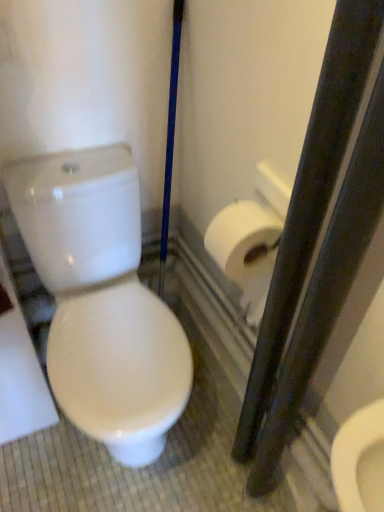
From the picture: What is the approximate height of white matte toilet paper at right?

The height of white matte toilet paper at right is 15.34 inches.

The image size is (384, 512). What do you see at coordinates (246, 251) in the screenshot? I see `white matte toilet paper at right` at bounding box center [246, 251].

The image size is (384, 512). Find the location of `white matte toilet paper at right`. white matte toilet paper at right is located at coordinates (246, 251).

Describe the element at coordinates (101, 300) in the screenshot. I see `white glossy toilet at left` at that location.

I want to click on white glossy toilet at left, so click(x=101, y=300).

What is the approximate height of white glossy toilet at left?

white glossy toilet at left is 30.87 inches tall.

Locate an element on the screen. white matte toilet paper at right is located at coordinates (246, 251).

Considering the positions of objects white glossy toilet at left and white matte toilet paper at right in the image provided, who is more to the left, white glossy toilet at left or white matte toilet paper at right?

white glossy toilet at left is more to the left.

Which is behind, white glossy toilet at left or white matte toilet paper at right?

Positioned behind is white matte toilet paper at right.

Is point (96, 237) behind point (251, 242)?

Yes, it is behind point (251, 242).

From the image's perspective, which is below, white glossy toilet at left or white matte toilet paper at right?

From the image's view, white glossy toilet at left is below.

From a real-world perspective, is white glossy toilet at left positioned above or below white matte toilet paper at right?

white glossy toilet at left is situated lower than white matte toilet paper at right in the real world.

Can you confirm if white glossy toilet at left is wider than white matte toilet paper at right?

Indeed, white glossy toilet at left has a greater width compared to white matte toilet paper at right.

Who is taller, white glossy toilet at left or white matte toilet paper at right?

white glossy toilet at left is taller.

Which of these two, white glossy toilet at left or white matte toilet paper at right, is smaller?

With smaller size is white matte toilet paper at right.

Is white matte toilet paper at right completely or partially inside white glossy toilet at left?

No, white matte toilet paper at right is located outside of white glossy toilet at left.

Can you see white glossy toilet at left touching white matte toilet paper at right?

There is a gap between white glossy toilet at left and white matte toilet paper at right.

Is white matte toilet paper at right at the back of white glossy toilet at left?

No.

Can you tell me how much white glossy toilet at left and white matte toilet paper at right differ in facing direction?

89.5 degrees.

Locate an element on the screen. toilet paper that is behind the white glossy toilet at left is located at coordinates point(246,251).

Is white matte toilet paper at right at the left side of white glossy toilet at left?

In fact, white matte toilet paper at right is to the right of white glossy toilet at left.

Which object is more forward, white matte toilet paper at right or white glossy toilet at left?

white glossy toilet at left is in front.

Which is closer, (273, 214) or (39, 189)?

The point (273, 214) is in front.

From the image's perspective, between white matte toilet paper at right and white glossy toilet at left, who is located below?

white glossy toilet at left is shown below in the image.

From a real-world perspective, is white matte toilet paper at right positioned under white glossy toilet at left based on gravity?

No, from a real-world perspective, white matte toilet paper at right is not beneath white glossy toilet at left.

Considering the relative sizes of white matte toilet paper at right and white glossy toilet at left in the image provided, is white matte toilet paper at right thinner than white glossy toilet at left?

Yes.

Looking at this image, does white matte toilet paper at right have a lesser height compared to white glossy toilet at left?

Correct, white matte toilet paper at right is not as tall as white glossy toilet at left.

Considering the sizes of objects white matte toilet paper at right and white glossy toilet at left in the image provided, who is smaller, white matte toilet paper at right or white glossy toilet at left?

white matte toilet paper at right is smaller.

Is white glossy toilet at left located within white matte toilet paper at right?

No.

Is white matte toilet paper at right in contact with white glossy toilet at left?

white matte toilet paper at right is not next to white glossy toilet at left, and they're not touching.

Could you tell me if white matte toilet paper at right is facing white glossy toilet at left?

Yes, white matte toilet paper at right is oriented towards white glossy toilet at left.

In the scene shown: Can you tell me how much white matte toilet paper at right and white glossy toilet at left differ in facing direction?

They differ by 89.5 degrees in their facing directions.

Image resolution: width=384 pixels, height=512 pixels. Find the location of `toilet paper above the white glossy toilet at left (from a real-world perspective)`. toilet paper above the white glossy toilet at left (from a real-world perspective) is located at coordinates (246, 251).

Where is `toilet below the white matte toilet paper at right (from the image's perspective)`? toilet below the white matte toilet paper at right (from the image's perspective) is located at coordinates (101, 300).

Find the location of a particular element. The width and height of the screenshot is (384, 512). toilet on the left of white matte toilet paper at right is located at coordinates (101, 300).